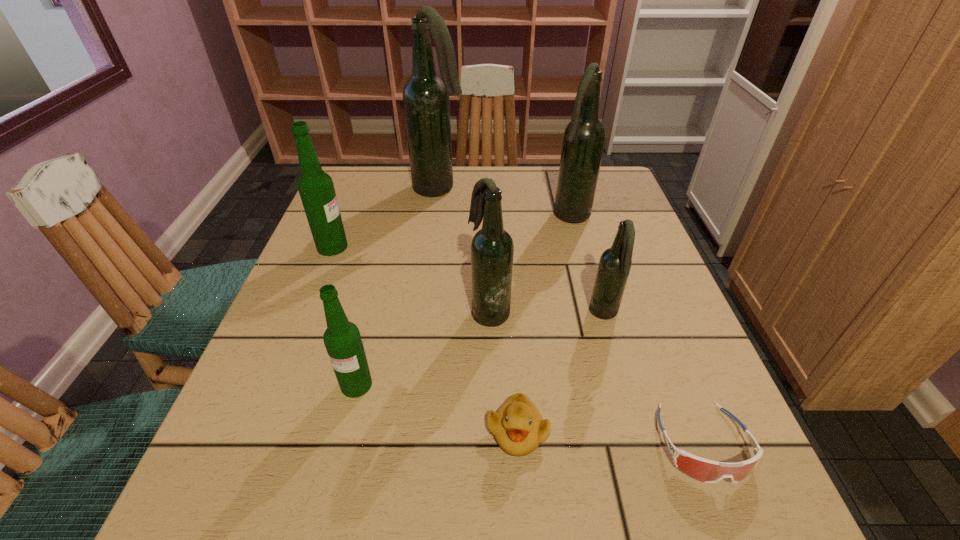
The image size is (960, 540). Identify the location of vacant area located 0.200m on the label of the nearest beer bottle. (322, 529).

Identify the location of object present at the near edge. (708, 471).

This screenshot has height=540, width=960. I want to click on goggles present at the right edge, so click(x=708, y=471).

Identify the location of object situated at the far right corner. (584, 137).

I want to click on object located at the near right corner, so click(x=708, y=471).

Locate an element on the screen. The image size is (960, 540). vacant space at the far edge is located at coordinates (413, 191).

In the image, there is a desktop. In order to click on vacant region at the near edge in this screenshot , I will do `click(426, 533)`.

The width and height of the screenshot is (960, 540). I want to click on free region at the left edge, so click(300, 359).

In the image, there is a desktop. What are the coordinates of `vacant space at the right edge` in the screenshot? It's located at (599, 213).

You are a GUI agent. You are given a task and a screenshot of the screen. Output one action in this format:
    pyautogui.click(x=<x>, y=<y>)
    Task: Click on the vacant space at the far left corner of the desktop
    
    Given the screenshot: What is the action you would take?
    pyautogui.click(x=355, y=193)